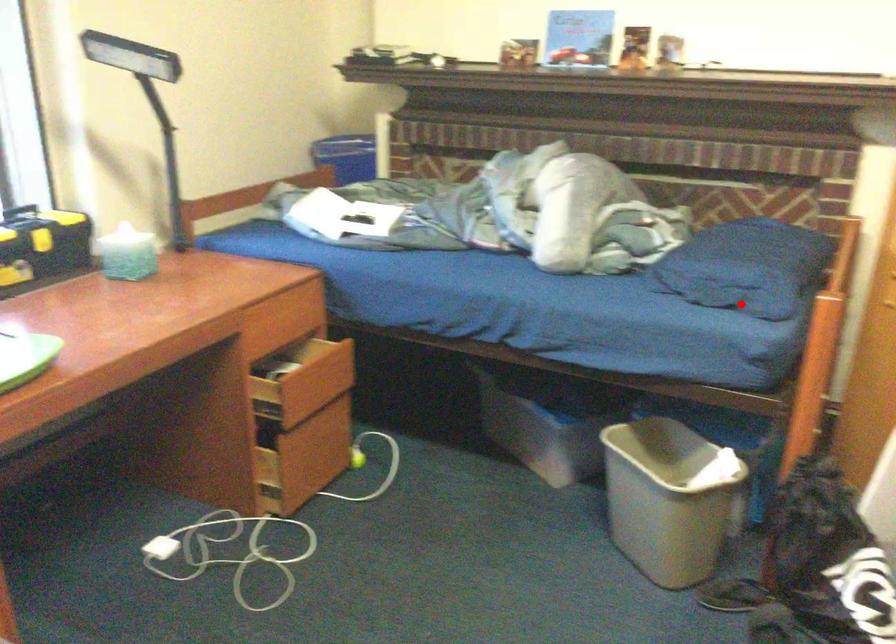
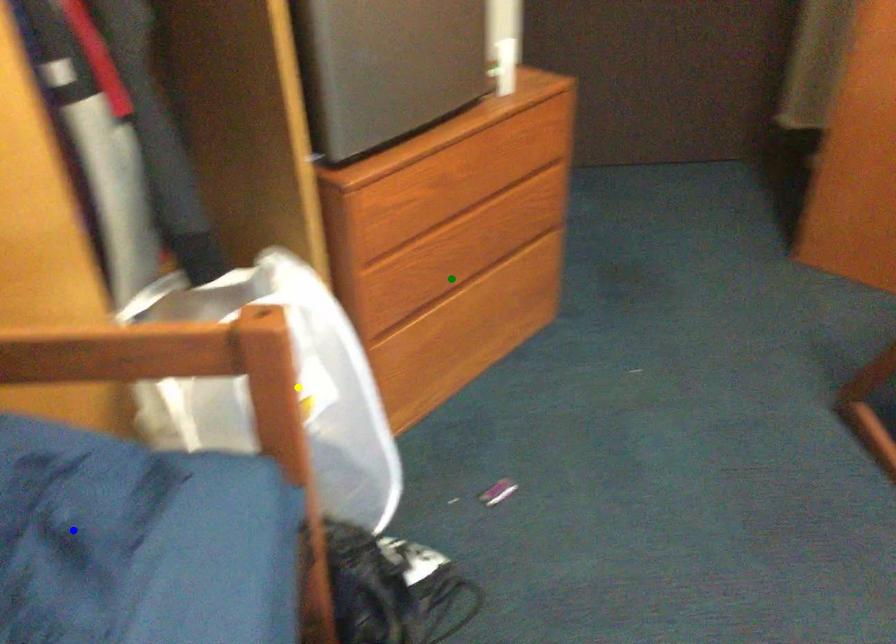
Question: I am providing you with two images of the same scene from different viewpoints. A red point is marked on the first image. You are given multiple points on the second image. Which spot in image 2 lines up with the point in image 1?

Choices:
 (A) green point
 (B) yellow point
 (C) blue point

Answer: (C)